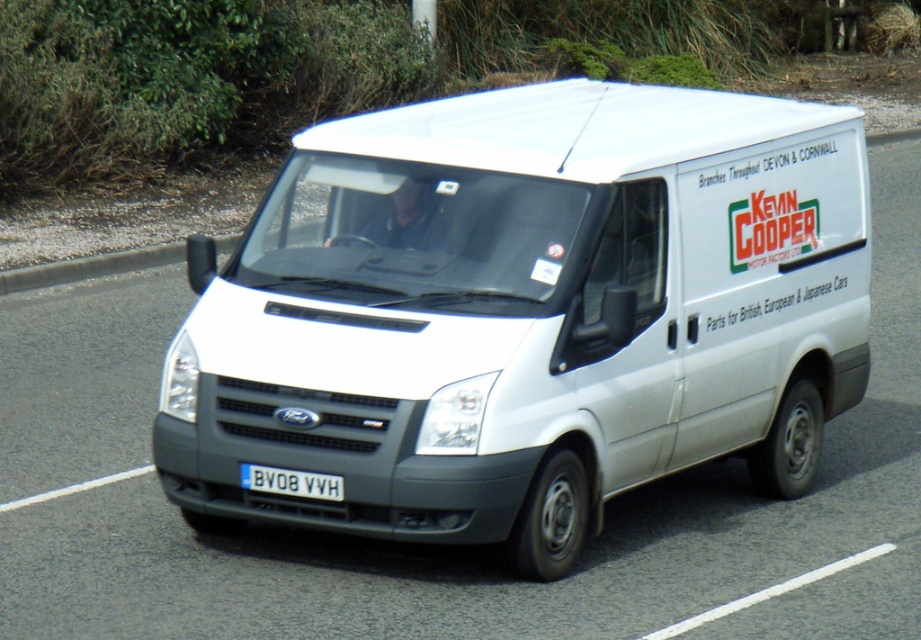
You are a pedestrian standing on the sidewalk. You see the white matte van at center and the white plastic license plate at center. Which object is closer to you?

The white matte van at center is closer to you because it is in front of the white plastic license plate at center.

You are a delivery driver who needs to enter a low clearance tunnel. The tunnel has a height limit of 2 meters. You see the white matte van at center and the white plastic license plate at center in your vehicle. Based on their sizes, do you think your van will fit under the tunnel?

The white matte van at center is much taller than the white plastic license plate at center. Since the license plate is part of the van, the van itself exceeds the height limit of 2 meters, so it will not fit under the tunnel.

You are a delivery driver who needs to park the white matte van at center in a parking spot that is exactly the same width as the white plastic license plate at center. Will the van fit in the parking spot?

The white matte van at center might be wider than the white plastic license plate at center, so it might not fit in the parking spot.